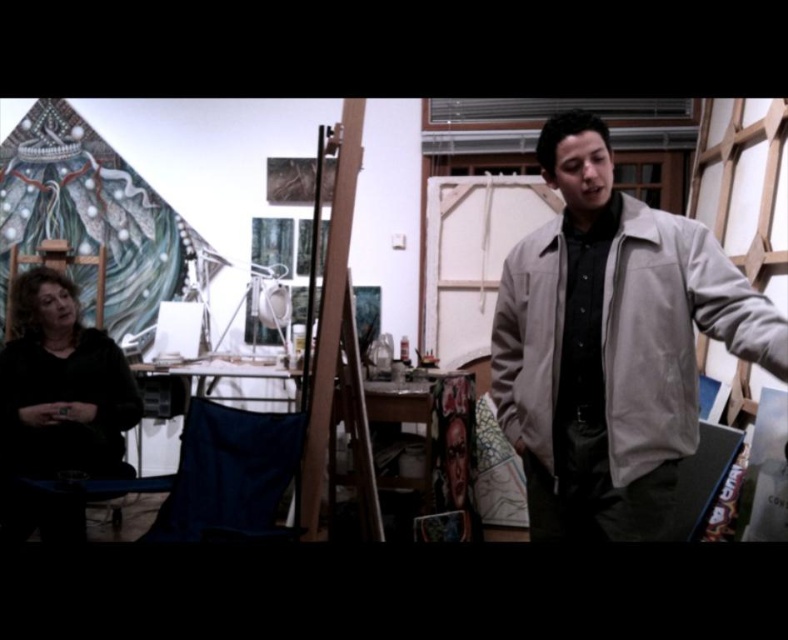
Is light beige jacket at center to the right of wooden easel at center from the viewer's perspective?

Indeed, light beige jacket at center is positioned on the right side of wooden easel at center.

I want to click on light beige jacket at center, so click(611, 344).

Image resolution: width=788 pixels, height=640 pixels. What are the coordinates of `light beige jacket at center` in the screenshot? It's located at (611, 344).

Image resolution: width=788 pixels, height=640 pixels. Find the location of `light beige jacket at center`. light beige jacket at center is located at coordinates (611, 344).

Who is positioned more to the left, light beige jacket at center or black matte shirt at lower left?

black matte shirt at lower left

Can you confirm if light beige jacket at center is positioned below black matte shirt at lower left?

No.

Between point (714, 307) and point (110, 433), which one is positioned behind?

The point (110, 433) is behind.

Where is `light beige jacket at center`? light beige jacket at center is located at coordinates (611, 344).

Does black matte shirt at lower left appear over wooden easel at center?

No.

This screenshot has width=788, height=640. I want to click on black matte shirt at lower left, so click(58, 392).

The height and width of the screenshot is (640, 788). In order to click on black matte shirt at lower left in this screenshot , I will do `click(58, 392)`.